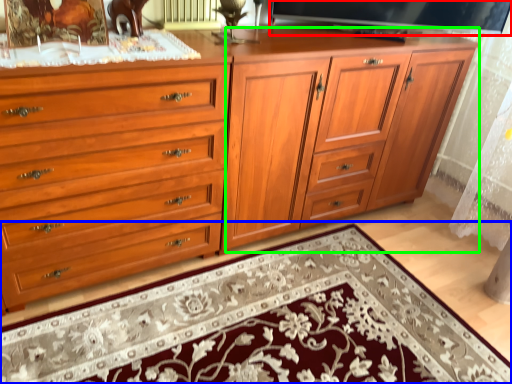
Question: Which is nearer to the television (highlighted by a red box)? mat (highlighted by a blue box) or tv cabinet (highlighted by a green box).

Choices:
 (A) mat
 (B) tv cabinet

Answer: (B)